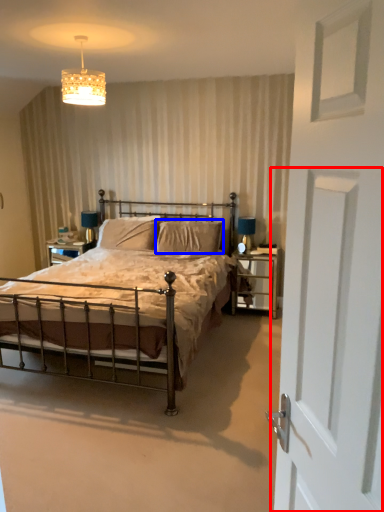
Question: Which object is closer to the camera taking this photo, screen door (highlighted by a red box) or pillow (highlighted by a blue box)?

Choices:
 (A) screen door
 (B) pillow

Answer: (A)